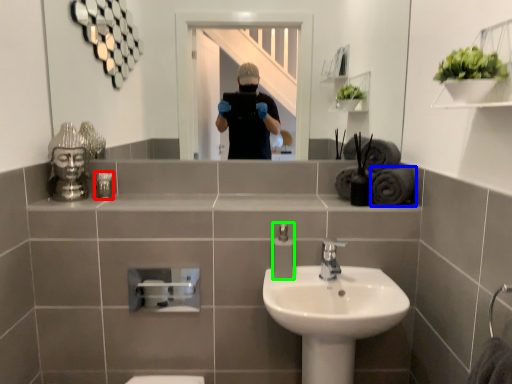
Question: Considering the real-world distances, which object is closest to toiletry (highlighted by a red box)? bath towel (highlighted by a blue box) or soap dispenser (highlighted by a green box).

Choices:
 (A) bath towel
 (B) soap dispenser

Answer: (B)